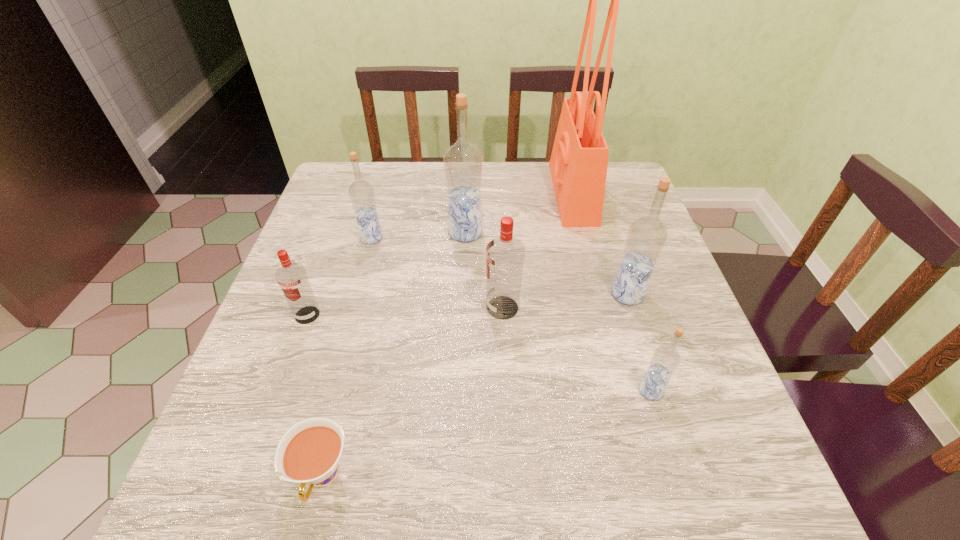
You are a GUI agent. You are given a task and a screenshot of the screen. Output one action in this format:
    pyautogui.click(x=<x>, y=<y>)
    Task: Click on the tallest object
    This screenshot has height=540, width=960.
    Given the screenshot: What is the action you would take?
    (579, 160)

Find the location of a particular element. This screenshot has width=960, height=540. the third vodka from left to right is located at coordinates (463, 162).

The image size is (960, 540). I want to click on the tallest vodka, so click(x=463, y=162).

This screenshot has height=540, width=960. In order to click on the third smallest blue vodka in this screenshot , I will do `click(646, 238)`.

You are a GUI agent. You are given a task and a screenshot of the screen. Output one action in this format:
    pyautogui.click(x=<x>, y=<y>)
    Task: Click on the second nearest blue vodka
    Image resolution: width=960 pixels, height=540 pixels.
    Given the screenshot: What is the action you would take?
    pyautogui.click(x=646, y=238)

Where is `the leftmost blue vodka`? Image resolution: width=960 pixels, height=540 pixels. the leftmost blue vodka is located at coordinates (361, 192).

Where is `the second vodka from left to right`? the second vodka from left to right is located at coordinates (361, 192).

Where is `the bigger red vodka`? The image size is (960, 540). the bigger red vodka is located at coordinates (505, 254).

Find the location of a particular element. This screenshot has height=540, width=960. the right red vodka is located at coordinates (505, 254).

Find the location of `the left red vodka`. the left red vodka is located at coordinates (292, 278).